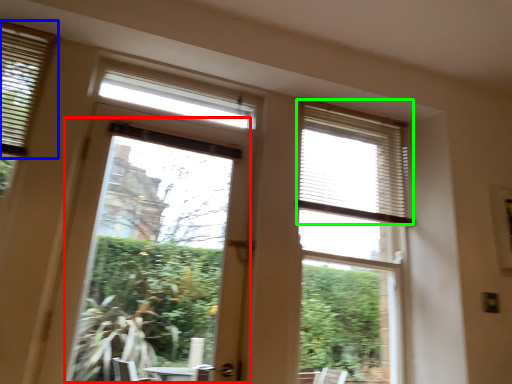
Question: Estimate the real-world distances between objects in this image. Which object is closer to window screen (highlighted by a red box), window blind (highlighted by a blue box) or blind (highlighted by a green box)?

Choices:
 (A) window blind
 (B) blind

Answer: (B)